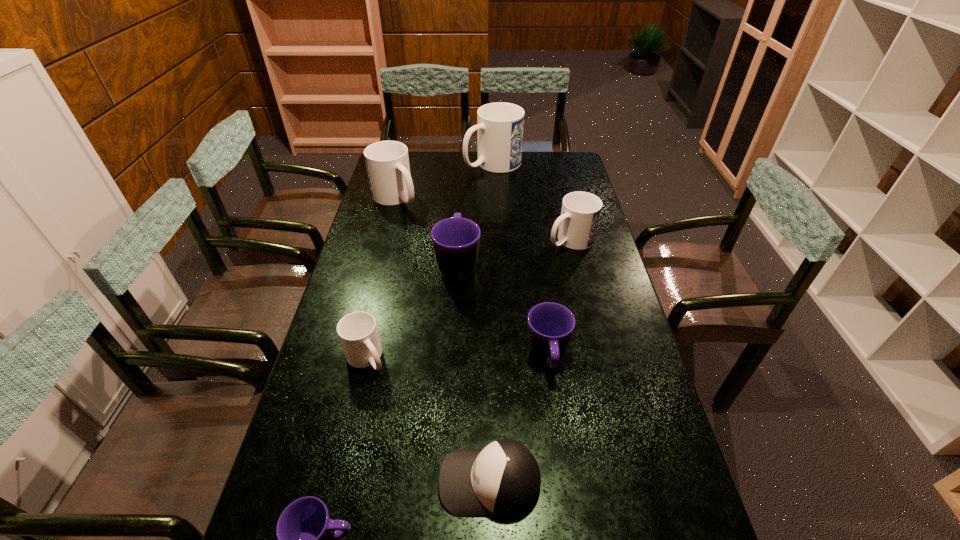
At what (x,y) coordinates should I click in order to perform the action: click on the farthest mug. Please return your answer as a coordinate pair (x, y). This screenshot has width=960, height=540. Looking at the image, I should click on (x=500, y=125).

The width and height of the screenshot is (960, 540). In order to click on the farthest blue mug in this screenshot , I will do `click(500, 125)`.

The width and height of the screenshot is (960, 540). Identify the location of the third smallest blue mug. (387, 162).

Where is `the second farthest mug`? The image size is (960, 540). the second farthest mug is located at coordinates (387, 162).

Where is `the farthest black mug`? This screenshot has height=540, width=960. the farthest black mug is located at coordinates (455, 241).

You are a GUI agent. You are given a task and a screenshot of the screen. Output one action in this format:
    pyautogui.click(x=<x>, y=<y>)
    Task: Click on the second black mug from right to left
    
    Given the screenshot: What is the action you would take?
    coord(455,241)

Identify the location of the rightmost blue mug. (580, 213).

In order to click on the second smallest blue mug in this screenshot , I will do `click(580, 213)`.

Locate an element on the screen. This screenshot has height=540, width=960. the second biggest black mug is located at coordinates (551, 325).

Locate an element on the screen. the second farthest black mug is located at coordinates (551, 325).